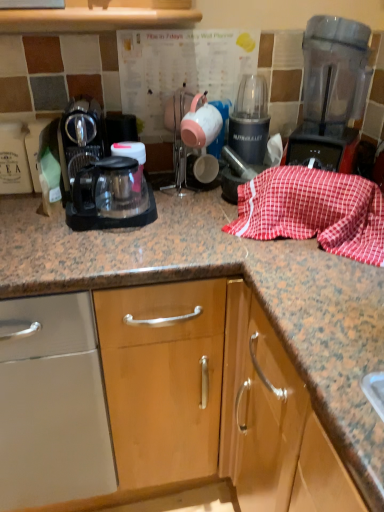
Question: Is matte ceramic tea pot at center further to the viewer compared to black plastic coffee maker at left?

Choices:
 (A) yes
 (B) no

Answer: (A)

Question: Is matte ceramic tea pot at center closer to the viewer compared to black plastic coffee maker at left?

Choices:
 (A) yes
 (B) no

Answer: (B)

Question: From a real-world perspective, is matte ceramic tea pot at center positioned over black plastic coffee maker at left based on gravity?

Choices:
 (A) yes
 (B) no

Answer: (A)

Question: Is matte ceramic tea pot at center far away from black plastic coffee maker at left?

Choices:
 (A) yes
 (B) no

Answer: (B)

Question: Does matte ceramic tea pot at center have a smaller size compared to black plastic coffee maker at left?

Choices:
 (A) yes
 (B) no

Answer: (A)

Question: Considering the positions of matte ceramic tea pot at center and black plastic coffee maker at left in the image, is matte ceramic tea pot at center bigger or smaller than black plastic coffee maker at left?

Choices:
 (A) small
 (B) big

Answer: (A)

Question: From the image's perspective, relative to black plastic coffee maker at left, is matte ceramic tea pot at center above or below?

Choices:
 (A) below
 (B) above

Answer: (B)

Question: Considering their positions, is matte ceramic tea pot at center located in front of or behind black plastic coffee maker at left?

Choices:
 (A) behind
 (B) front

Answer: (A)

Question: Does point (190, 112) appear closer or farther from the camera than point (125, 172)?

Choices:
 (A) farther
 (B) closer

Answer: (A)

Question: Is red checkered cloth at center to the left or to the right of black plastic blender at center in the image?

Choices:
 (A) right
 (B) left

Answer: (A)

Question: Relative to black plastic blender at center, is red checkered cloth at center in front or behind?

Choices:
 (A) behind
 (B) front

Answer: (B)

Question: Would you say red checkered cloth at center is inside or outside black plastic blender at center?

Choices:
 (A) inside
 (B) outside

Answer: (B)

Question: Looking at their shapes, would you say red checkered cloth at center is wider or thinner than black plastic blender at center?

Choices:
 (A) thin
 (B) wide

Answer: (B)

Question: Based on their sizes in the image, would you say black plastic coffee maker at left is bigger or smaller than black plastic blender at center?

Choices:
 (A) small
 (B) big

Answer: (B)

Question: Is black plastic coffee maker at left situated inside black plastic blender at center or outside?

Choices:
 (A) outside
 (B) inside

Answer: (A)